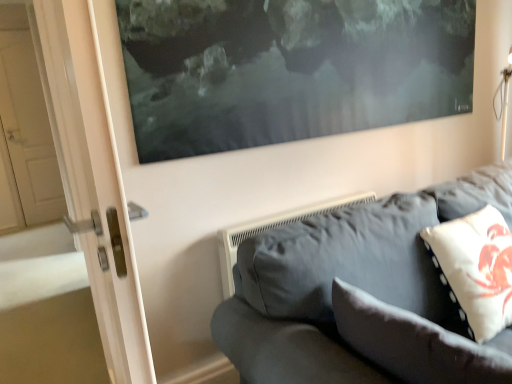
The height and width of the screenshot is (384, 512). Identify the location of white dotted fabric pillow at right, marked as the 2th pillow in a left-to-right arrangement. (475, 269).

This screenshot has height=384, width=512. Identify the location of dark gray fabric couch at lower right. [343, 280].

The height and width of the screenshot is (384, 512). I want to click on white dotted fabric pillow at right, marked as the 2th pillow in a left-to-right arrangement, so click(x=475, y=269).

Which is in front, point (313, 375) or point (403, 350)?

Positioned in front is point (403, 350).

From a real-world perspective, is dark gray fabric couch at lower right physically above white fabric pillow at lower right, which ranks as the 2th pillow in right-to-left order?

No.

Is dark gray fabric couch at lower right positioned beyond the bounds of white fabric pillow at lower right, marked as the first pillow in a left-to-right arrangement?

dark gray fabric couch at lower right lies outside white fabric pillow at lower right, marked as the first pillow in a left-to-right arrangement,'s area.

Considering the relative positions of dark gray fabric couch at lower right and white fabric pillow at lower right, marked as the first pillow in a left-to-right arrangement, in the image provided, is dark gray fabric couch at lower right to the left or to the right of white fabric pillow at lower right, marked as the first pillow in a left-to-right arrangement,?

dark gray fabric couch at lower right is to the right of white fabric pillow at lower right, marked as the first pillow in a left-to-right arrangement.

Identify the location of studio couch in front of the white dotted fabric pillow at right, marked as the 2th pillow in a left-to-right arrangement. (343, 280).

Between white dotted fabric pillow at right, marked as the 2th pillow in a left-to-right arrangement, and dark gray fabric couch at lower right, which one has smaller size?

white dotted fabric pillow at right, marked as the 2th pillow in a left-to-right arrangement.

Who is taller, white dotted fabric pillow at right, the 1th pillow in the right-to-left sequence, or dark gray fabric couch at lower right?

dark gray fabric couch at lower right.

Is white dotted fabric pillow at right, the 1th pillow in the right-to-left sequence, positioned beyond the bounds of dark gray fabric couch at lower right?

Actually, white dotted fabric pillow at right, the 1th pillow in the right-to-left sequence, is at least partially inside dark gray fabric couch at lower right.

Which object is wider, white fabric pillow at lower right, which ranks as the 2th pillow in right-to-left order, or white dotted fabric pillow at right, marked as the 2th pillow in a left-to-right arrangement?

white dotted fabric pillow at right, marked as the 2th pillow in a left-to-right arrangement, is wider.

From the image's perspective, between white fabric pillow at lower right, marked as the first pillow in a left-to-right arrangement, and white dotted fabric pillow at right, marked as the 2th pillow in a left-to-right arrangement, who is located below?

From the image's view, white fabric pillow at lower right, marked as the first pillow in a left-to-right arrangement, is below.

Is point (434, 373) farther from camera compared to point (494, 244)?

No, it is not.

Identify the location of pillow to the left of white dotted fabric pillow at right, marked as the 2th pillow in a left-to-right arrangement. This screenshot has height=384, width=512. (413, 342).

Looking at their sizes, would you say white fabric pillow at lower right, marked as the first pillow in a left-to-right arrangement, is wider or thinner than dark gray fabric couch at lower right?

Considering their sizes, white fabric pillow at lower right, marked as the first pillow in a left-to-right arrangement, looks slimmer than dark gray fabric couch at lower right.

From a real-world perspective, which object stands above the other?

In real-world perspective, white fabric pillow at lower right, marked as the first pillow in a left-to-right arrangement, is above.

Considering the sizes of objects white fabric pillow at lower right, which ranks as the 2th pillow in right-to-left order, and dark gray fabric couch at lower right in the image provided, who is taller, white fabric pillow at lower right, which ranks as the 2th pillow in right-to-left order, or dark gray fabric couch at lower right?

Standing taller between the two is dark gray fabric couch at lower right.

Are white fabric pillow at lower right, marked as the first pillow in a left-to-right arrangement, and dark gray fabric couch at lower right located far from each other?

white fabric pillow at lower right, marked as the first pillow in a left-to-right arrangement, is actually quite close to dark gray fabric couch at lower right.

Based on the photo, is dark gray fabric couch at lower right aimed at white dotted fabric pillow at right, marked as the 2th pillow in a left-to-right arrangement?

Yes, dark gray fabric couch at lower right is facing white dotted fabric pillow at right, marked as the 2th pillow in a left-to-right arrangement.

Which object is more forward, dark gray fabric couch at lower right or white dotted fabric pillow at right, marked as the 2th pillow in a left-to-right arrangement?

dark gray fabric couch at lower right is closer to the camera.

Is dark gray fabric couch at lower right taller than white dotted fabric pillow at right, the 1th pillow in the right-to-left sequence?

Correct, dark gray fabric couch at lower right is much taller as white dotted fabric pillow at right, the 1th pillow in the right-to-left sequence.

From the image's perspective, is dark gray fabric couch at lower right positioned above or below white dotted fabric pillow at right, the 1th pillow in the right-to-left sequence?

Based on their image positions, dark gray fabric couch at lower right is located beneath white dotted fabric pillow at right, the 1th pillow in the right-to-left sequence.

From a real-world perspective, which is physically below, white dotted fabric pillow at right, the 1th pillow in the right-to-left sequence, or white fabric pillow at lower right, marked as the first pillow in a left-to-right arrangement?

white fabric pillow at lower right, marked as the first pillow in a left-to-right arrangement, from a real-world perspective.

Is point (505, 287) closer or farther from the camera than point (426, 368)?

Point (505, 287) is positioned farther from the camera compared to point (426, 368).

Is white dotted fabric pillow at right, marked as the 2th pillow in a left-to-right arrangement, surrounding white fabric pillow at lower right, which ranks as the 2th pillow in right-to-left order?

No.

Is white dotted fabric pillow at right, marked as the 2th pillow in a left-to-right arrangement, bigger than white fabric pillow at lower right, marked as the first pillow in a left-to-right arrangement?

Correct, white dotted fabric pillow at right, marked as the 2th pillow in a left-to-right arrangement, is larger in size than white fabric pillow at lower right, marked as the first pillow in a left-to-right arrangement.

Where is `pillow located below the dark gray fabric couch at lower right (from the image's perspective)`? The width and height of the screenshot is (512, 384). pillow located below the dark gray fabric couch at lower right (from the image's perspective) is located at coordinates (413, 342).

Identify the location of pillow above the dark gray fabric couch at lower right (from the image's perspective). The image size is (512, 384). (475, 269).

Based on their spatial positions, is dark gray fabric couch at lower right or white fabric pillow at lower right, which ranks as the 2th pillow in right-to-left order, further from white dotted fabric pillow at right, marked as the 2th pillow in a left-to-right arrangement?

white fabric pillow at lower right, which ranks as the 2th pillow in right-to-left order, is positioned further to the anchor white dotted fabric pillow at right, marked as the 2th pillow in a left-to-right arrangement.

Considering their positions, is dark gray fabric couch at lower right positioned further to white fabric pillow at lower right, marked as the first pillow in a left-to-right arrangement, than white dotted fabric pillow at right, marked as the 2th pillow in a left-to-right arrangement?

Among the two, white dotted fabric pillow at right, marked as the 2th pillow in a left-to-right arrangement, is located further to white fabric pillow at lower right, marked as the first pillow in a left-to-right arrangement.

Looking at the image, which one is located closer to white fabric pillow at lower right, marked as the first pillow in a left-to-right arrangement, white dotted fabric pillow at right, marked as the 2th pillow in a left-to-right arrangement, or dark gray fabric couch at lower right?

Among the two, dark gray fabric couch at lower right is located nearer to white fabric pillow at lower right, marked as the first pillow in a left-to-right arrangement.

Considering their positions, is white fabric pillow at lower right, which ranks as the 2th pillow in right-to-left order, positioned closer to dark gray fabric couch at lower right than white dotted fabric pillow at right, marked as the 2th pillow in a left-to-right arrangement?

white fabric pillow at lower right, which ranks as the 2th pillow in right-to-left order, is closer to dark gray fabric couch at lower right.

Looking at the image, which one is located further to dark gray fabric couch at lower right, white dotted fabric pillow at right, the 1th pillow in the right-to-left sequence, or white fabric pillow at lower right, which ranks as the 2th pillow in right-to-left order?

The object further to dark gray fabric couch at lower right is white dotted fabric pillow at right, the 1th pillow in the right-to-left sequence.

Estimate the real-world distances between objects in this image. Which object is closer to white dotted fabric pillow at right, marked as the 2th pillow in a left-to-right arrangement, white fabric pillow at lower right, marked as the first pillow in a left-to-right arrangement, or dark gray fabric couch at lower right?

dark gray fabric couch at lower right.

Find the location of a particular element. The height and width of the screenshot is (384, 512). pillow between dark gray fabric couch at lower right and white dotted fabric pillow at right, the 1th pillow in the right-to-left sequence, along the z-axis is located at coordinates (413, 342).